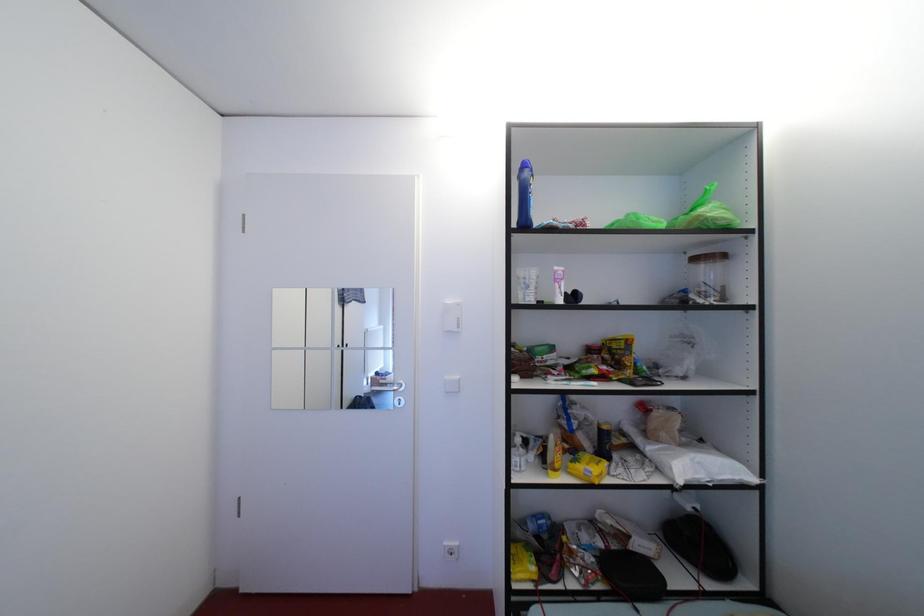
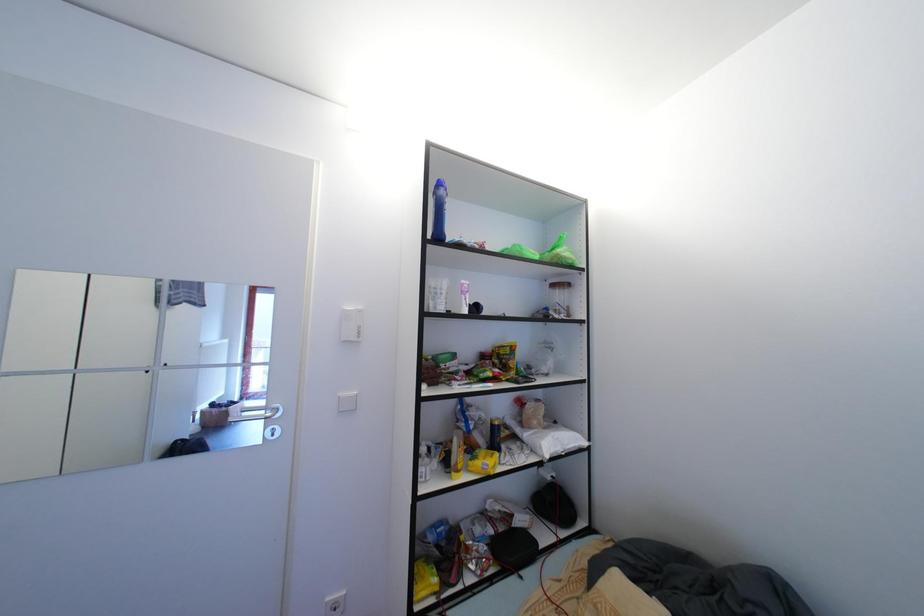
Question: The images are taken continuously from a first-person perspective. In which direction is your viewpoint rotating?

Choices:
 (A) Left
 (B) Right
 (C) Up
 (D) Down

Answer: (B)